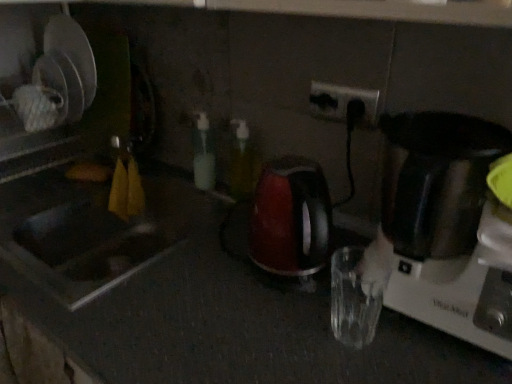
Question: Can you confirm if translucent plastic bottle at center, acting as the 1th bottle starting from the left, is smaller than white plastic electric outlet at upper center?

Choices:
 (A) no
 (B) yes

Answer: (A)

Question: From the image's perspective, does translucent plastic bottle at center, which is counted as the 2th bottle, starting from the right, appear lower than white plastic electric outlet at upper center?

Choices:
 (A) no
 (B) yes

Answer: (B)

Question: Does translucent plastic bottle at center, acting as the 1th bottle starting from the left, have a lesser width compared to white plastic electric outlet at upper center?

Choices:
 (A) no
 (B) yes

Answer: (A)

Question: Does translucent plastic bottle at center, which is counted as the 2th bottle, starting from the right, turn towards white plastic electric outlet at upper center?

Choices:
 (A) no
 (B) yes

Answer: (A)

Question: Does translucent plastic bottle at center, acting as the 1th bottle starting from the left, have a lesser height compared to white plastic electric outlet at upper center?

Choices:
 (A) no
 (B) yes

Answer: (A)

Question: Is translucent plastic bottle at center, acting as the 1th bottle starting from the left, bigger than white plastic electric outlet at upper center?

Choices:
 (A) yes
 (B) no

Answer: (A)

Question: From a real-world perspective, is white plastic electric outlet at upper center located beneath translucent plastic bottle at center, which is counted as the 2th bottle, starting from the right?

Choices:
 (A) no
 (B) yes

Answer: (A)

Question: From a real-world perspective, is white plastic electric outlet at upper center located higher than translucent plastic bottle at center, acting as the 1th bottle starting from the left?

Choices:
 (A) yes
 (B) no

Answer: (A)

Question: Does white plastic electric outlet at upper center touch translucent plastic bottle at center, which is counted as the 2th bottle, starting from the right?

Choices:
 (A) yes
 (B) no

Answer: (B)

Question: Can you confirm if white plastic electric outlet at upper center is taller than translucent plastic bottle at center, which is counted as the 2th bottle, starting from the right?

Choices:
 (A) no
 (B) yes

Answer: (A)

Question: Could you tell me if white plastic electric outlet at upper center is facing translucent plastic bottle at center, which is counted as the 2th bottle, starting from the right?

Choices:
 (A) no
 (B) yes

Answer: (A)

Question: Is white plastic electric outlet at upper center at the left side of translucent plastic bottle at center, acting as the 1th bottle starting from the left?

Choices:
 (A) no
 (B) yes

Answer: (A)

Question: Does white plastic electric outlet at upper center have a lesser width compared to green translucent bottle at center, the 1th bottle positioned from the right?

Choices:
 (A) yes
 (B) no

Answer: (A)